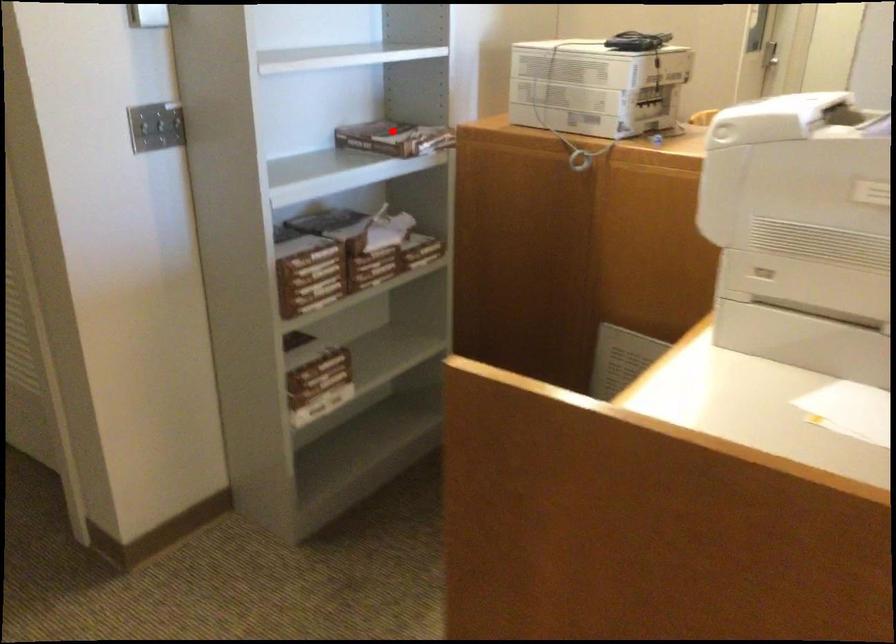
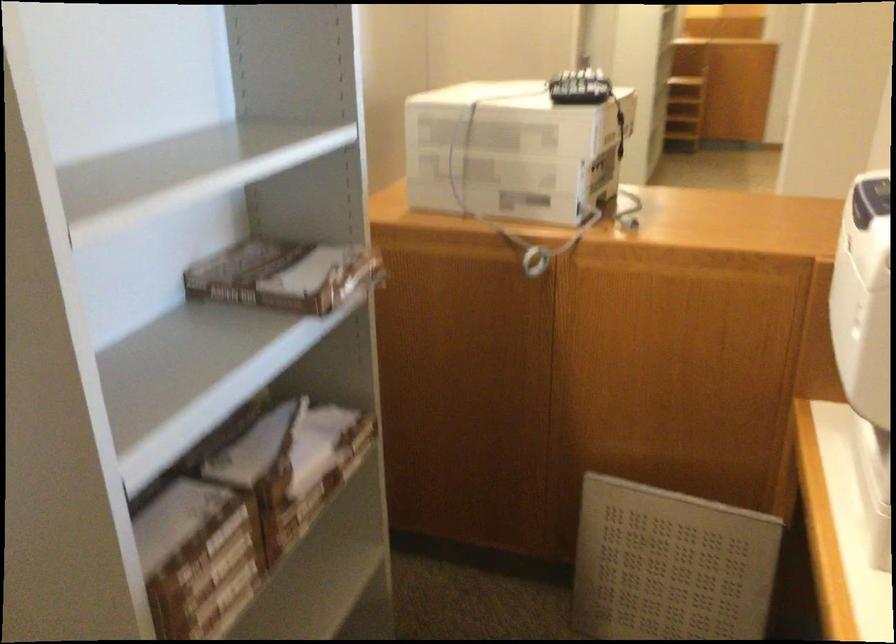
Locate, in the second image, the point that corresponds to the highlighted location in the first image.

(280, 275)